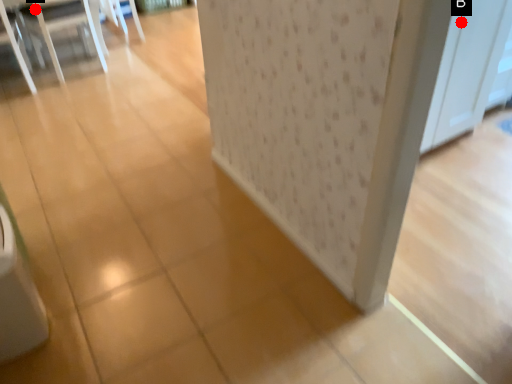
Question: Two points are circled on the image, labeled by A and B beside each circle. Which of the following is the farthest from the observer?

Choices:
 (A) A is further
 (B) B is further

Answer: (A)